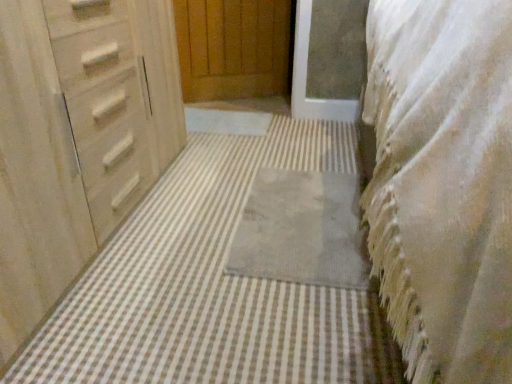
Question: From the image's perspective, is gray soft rug at center, the second bath mat when ordered from front to back, beneath gray soft rug at center, which is the 1th bath mat in front-to-back order?

Choices:
 (A) yes
 (B) no

Answer: (A)

Question: Considering the relative sizes of gray soft rug at center, positioned as the 1th bath mat in back-to-front order, and gray soft rug at center, the 2th bath mat when ordered from back to front, in the image provided, is gray soft rug at center, positioned as the 1th bath mat in back-to-front order, smaller than gray soft rug at center, the 2th bath mat when ordered from back to front,?

Choices:
 (A) no
 (B) yes

Answer: (B)

Question: Does gray soft rug at center, the second bath mat when ordered from front to back, turn towards gray soft rug at center, which is the 1th bath mat in front-to-back order?

Choices:
 (A) yes
 (B) no

Answer: (A)

Question: Can you confirm if gray soft rug at center, the second bath mat when ordered from front to back, is positioned to the right of gray soft rug at center, which is the 1th bath mat in front-to-back order?

Choices:
 (A) no
 (B) yes

Answer: (B)

Question: Is gray soft rug at center, positioned as the 1th bath mat in back-to-front order, completely or partially outside of gray soft rug at center, which is the 1th bath mat in front-to-back order?

Choices:
 (A) no
 (B) yes

Answer: (A)

Question: From the image's perspective, is gray soft rug at center, positioned as the 1th bath mat in back-to-front order, above or below gray soft rug at center, which is the 1th bath mat in front-to-back order?

Choices:
 (A) below
 (B) above

Answer: (A)

Question: From a real-world perspective, is gray soft rug at center, the second bath mat when ordered from front to back, above or below gray soft rug at center, which is the 1th bath mat in front-to-back order?

Choices:
 (A) below
 (B) above

Answer: (B)

Question: Is gray soft rug at center, positioned as the 1th bath mat in back-to-front order, in front of or behind gray soft rug at center, the 2th bath mat when ordered from back to front, in the image?

Choices:
 (A) behind
 (B) front

Answer: (A)

Question: Would you say gray soft rug at center, the second bath mat when ordered from front to back, is inside or outside gray soft rug at center, the 2th bath mat when ordered from back to front?

Choices:
 (A) outside
 (B) inside

Answer: (B)

Question: From a real-world perspective, is white textured blanket at right physically located above or below matte wood chest of drawers at left?

Choices:
 (A) below
 (B) above

Answer: (B)

Question: Based on their sizes in the image, would you say white textured blanket at right is bigger or smaller than matte wood chest of drawers at left?

Choices:
 (A) small
 (B) big

Answer: (B)

Question: Visually, is white textured blanket at right positioned to the left or to the right of matte wood chest of drawers at left?

Choices:
 (A) right
 (B) left

Answer: (A)

Question: In terms of height, does white textured blanket at right look taller or shorter compared to matte wood chest of drawers at left?

Choices:
 (A) tall
 (B) short

Answer: (A)

Question: From their relative heights in the image, would you say matte wood chest of drawers at left is taller or shorter than gray soft rug at center, the second bath mat when ordered from front to back?

Choices:
 (A) short
 (B) tall

Answer: (B)

Question: From a real-world perspective, is matte wood chest of drawers at left physically located above or below gray soft rug at center, positioned as the 1th bath mat in back-to-front order?

Choices:
 (A) below
 (B) above

Answer: (B)